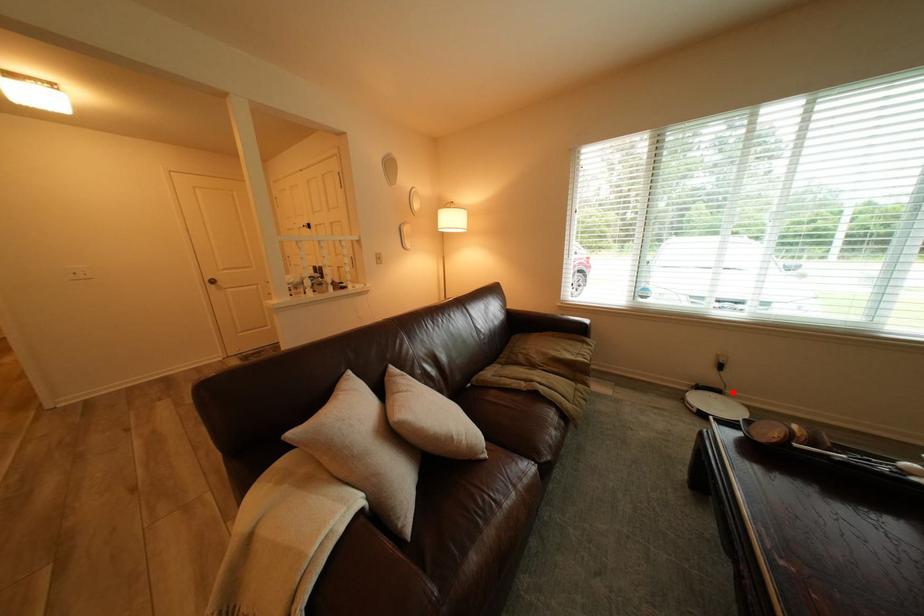
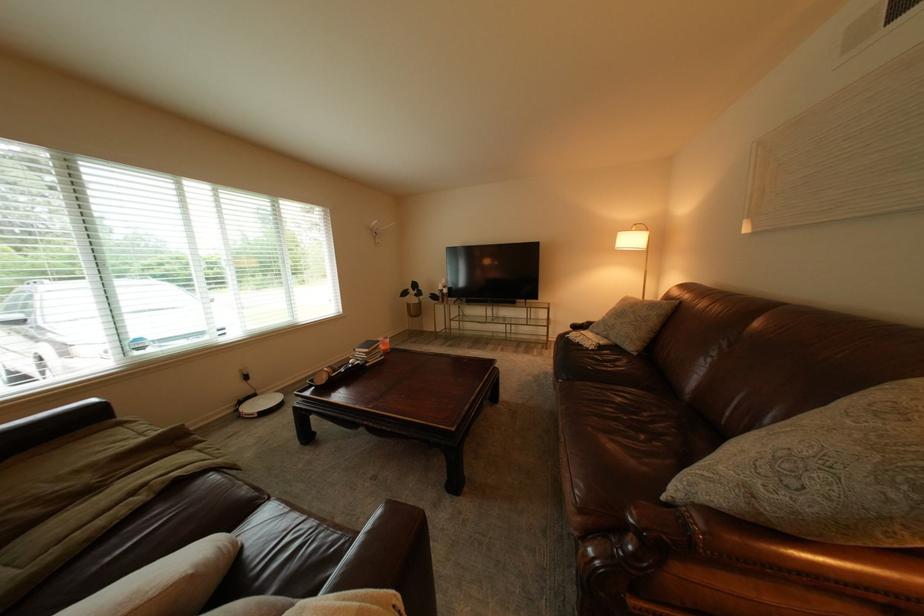
Question: I am providing you with two images of the same scene from different viewpoints. Given a red point in image1, look at the same physical point in image2. Is it:

Choices:
 (A) Closer to the viewpoint
 (B) Farther from the viewpoint

Answer: (B)